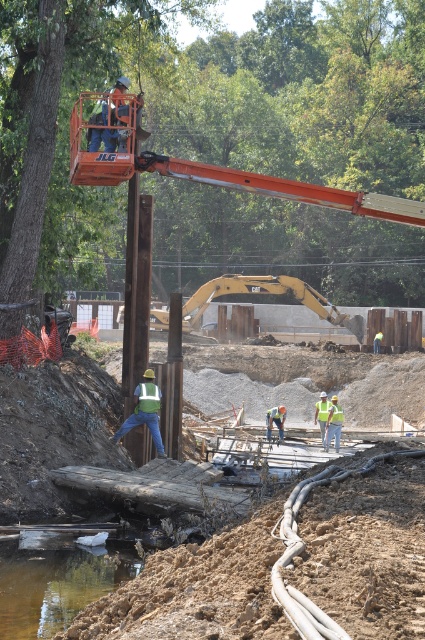
Question: Can you confirm if brown wooden plank at center is wider than green reflective safety vest at center?

Choices:
 (A) yes
 (B) no

Answer: (A)

Question: Which of the following is the closest to the observer?

Choices:
 (A) green reflective safety vest at lower center
 (B) brown wooden plank at center

Answer: (B)

Question: From the image, what is the correct spatial relationship of brown wooden plank at center in relation to green reflective safety vest at center?

Choices:
 (A) right
 (B) left

Answer: (B)

Question: Does green reflective safety vest at lower center appear on the left side of green reflective safety vest at center?

Choices:
 (A) no
 (B) yes

Answer: (B)

Question: Among these points, which one is nearest to the camera?

Choices:
 (A) click(320, 604)
 (B) click(147, 390)

Answer: (A)

Question: Among these objects, which one is farthest from the camera?

Choices:
 (A) green reflective safety vest at lower center
 (B) brown wooden plank at center
 (C) green reflective safety vest at center

Answer: (C)